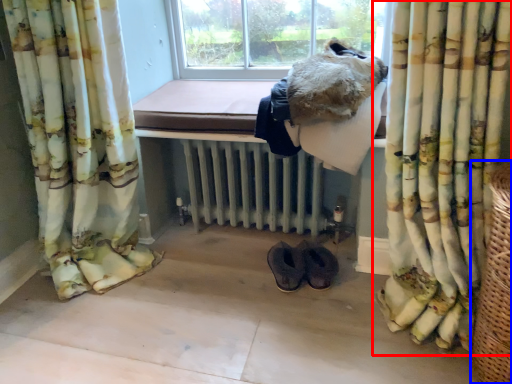
Question: Among these objects, which one is farthest to the camera, curtain (highlighted by a red box) or basket (highlighted by a blue box)?

Choices:
 (A) curtain
 (B) basket

Answer: (A)